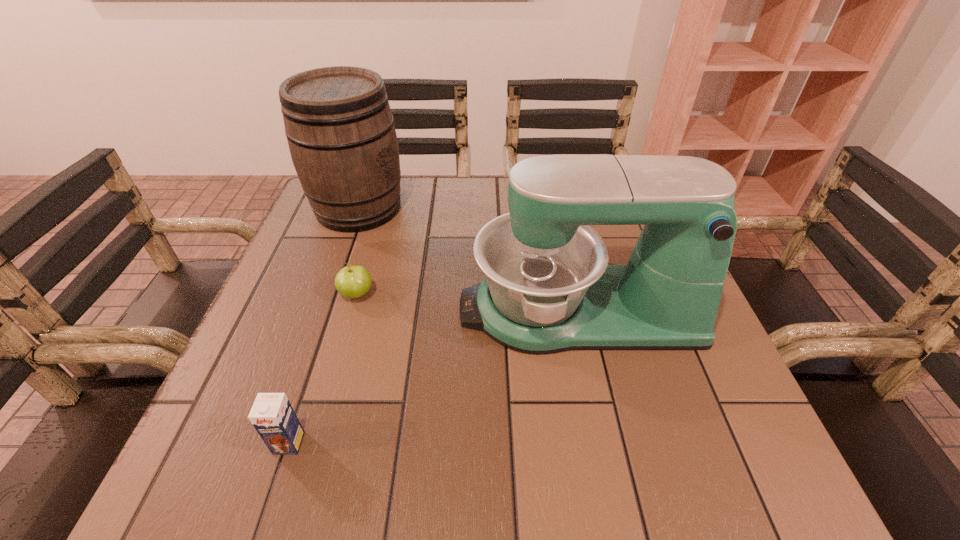
This screenshot has width=960, height=540. Find the location of `object that is at the far edge`. object that is at the far edge is located at coordinates (341, 135).

At what (x,y) coordinates should I click in order to perform the action: click on object at the near edge. Please return your answer as a coordinate pair (x, y). Looking at the image, I should click on (272, 415).

I want to click on wine bucket present at the left edge, so click(341, 135).

Where is `chocolate milk situated at the left edge`? This screenshot has width=960, height=540. chocolate milk situated at the left edge is located at coordinates (272, 415).

Identify the location of apple that is positioned at the left edge. (353, 281).

The image size is (960, 540). Find the location of `object at the right edge`. object at the right edge is located at coordinates (548, 288).

The image size is (960, 540). What are the coordinates of `object situated at the far left corner` in the screenshot? It's located at pyautogui.click(x=341, y=135).

The width and height of the screenshot is (960, 540). Identify the location of object present at the near left corner. (272, 415).

In the image, there is a desktop. Identify the location of vacant area at the far edge. (469, 180).

This screenshot has width=960, height=540. What are the coordinates of `vacant space at the near edge` in the screenshot? It's located at (458, 486).